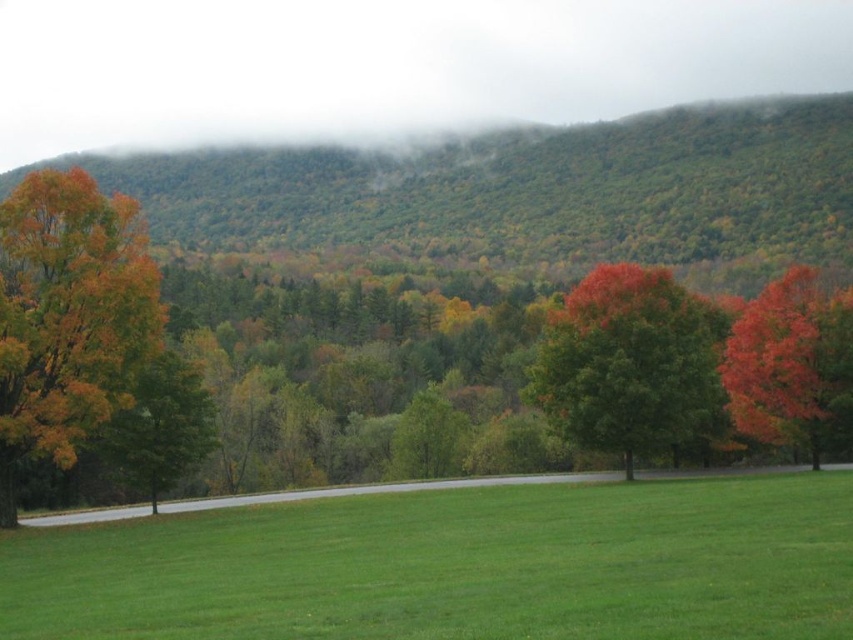
Question: Which point is closer to the camera taking this photo?

Choices:
 (A) (137, 380)
 (B) (77, 449)
 (C) (787, 353)
 (D) (569, 388)

Answer: (B)

Question: Is orange leafy tree at left positioned at the back of green matte tree at left?

Choices:
 (A) no
 (B) yes

Answer: (A)

Question: Which point appears closest to the camera in this image?

Choices:
 (A) (645, 401)
 (B) (816, 588)

Answer: (B)

Question: Where is green grassy field at center located in relation to orange leafy tree at left in the image?

Choices:
 (A) right
 (B) left

Answer: (A)

Question: Which is nearer to the orange leafy tree at left?

Choices:
 (A) bright red leafy tree at right
 (B) green grassy field at center
 (C) shiny red tree at center

Answer: (B)

Question: Is orange leafy tree at left to the right of green matte tree at left from the viewer's perspective?

Choices:
 (A) no
 (B) yes

Answer: (A)